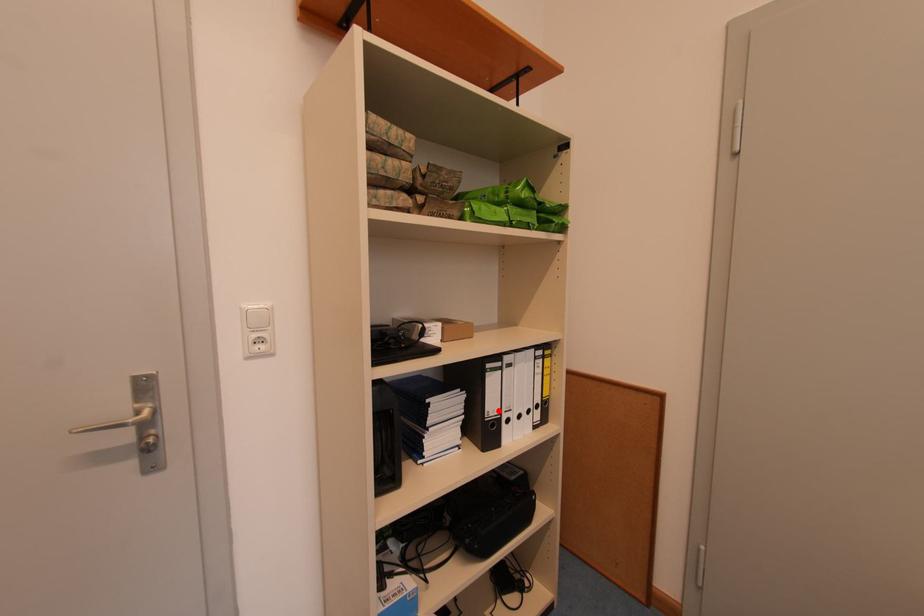
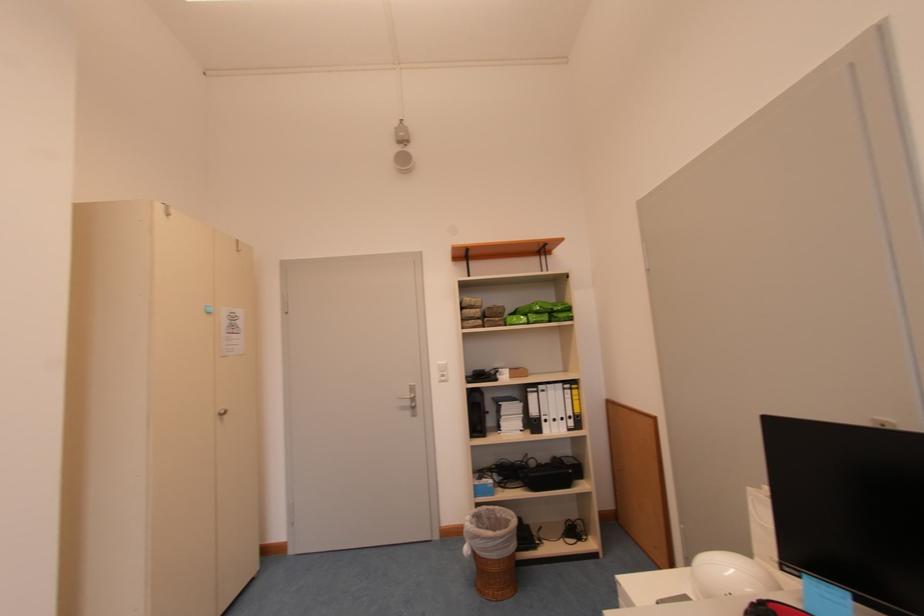
The point at the highlighted location is marked in the first image. Where is the corresponding point in the second image?

(541, 415)